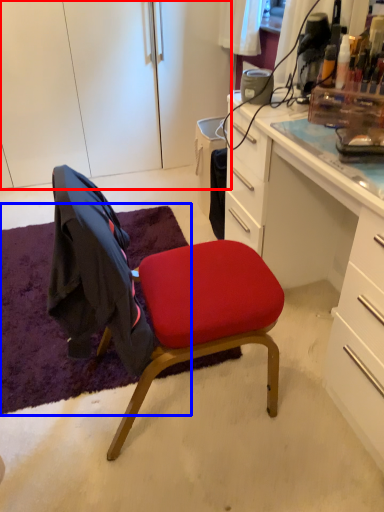
Question: Which object is closer to the camera taking this photo, cabinetry (highlighted by a red box) or mat (highlighted by a blue box)?

Choices:
 (A) cabinetry
 (B) mat

Answer: (B)